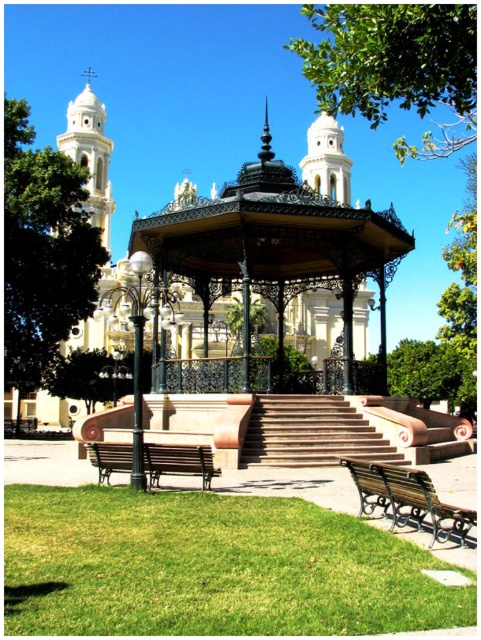
Who is more distant from viewer, (337, 67) or (226, 317)?

Point (226, 317)

Is point (407, 93) behind point (238, 317)?

No, (407, 93) is closer to viewer.

Is point (381, 12) in front of point (227, 323)?

Yes, it is in front of point (227, 323).

You are a GUI agent. You are given a task and a screenshot of the screen. Output one action in this format:
    pyautogui.click(x=<x>, y=<y>)
    Task: Click on the green leafy tree at upper center
    
    Given the screenshot: What is the action you would take?
    pyautogui.click(x=395, y=65)

Does wooden park bench at lower right appear over green leafy tree at center?

No.

Is wooden park bench at lower right shorter than green leafy tree at center?

→ Indeed, wooden park bench at lower right has a lesser height compared to green leafy tree at center.

Locate an element on the screen. Image resolution: width=481 pixels, height=640 pixels. wooden park bench at lower right is located at coordinates (419, 502).

Does green leafy tree at upper center appear on the left side of terracotta stone stairs at center?

In fact, green leafy tree at upper center is to the right of terracotta stone stairs at center.

Does green leafy tree at upper center appear under terracotta stone stairs at center?

No.

Who is more distant from viewer, (391, 45) or (364, 426)?

The point (364, 426) is behind.

The width and height of the screenshot is (481, 640). Identify the location of green leafy tree at upper center. (395, 65).